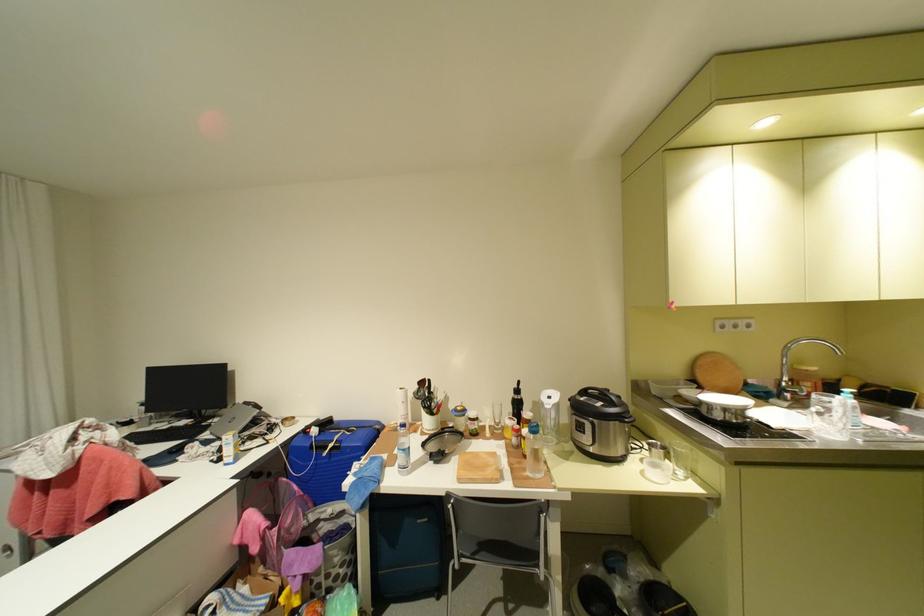
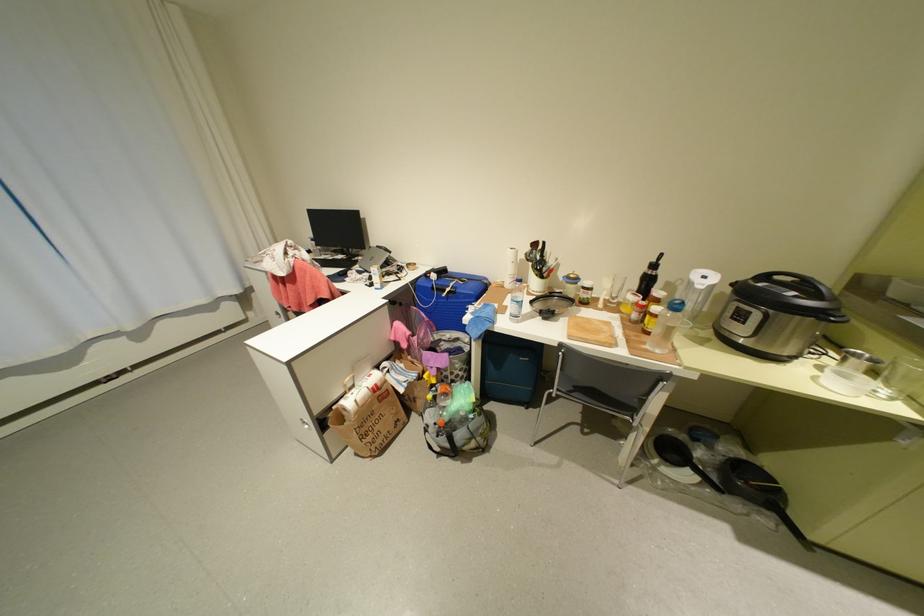
Locate, in the second image, the point that corresponds to point 403,424 in the first image.

(508, 282)